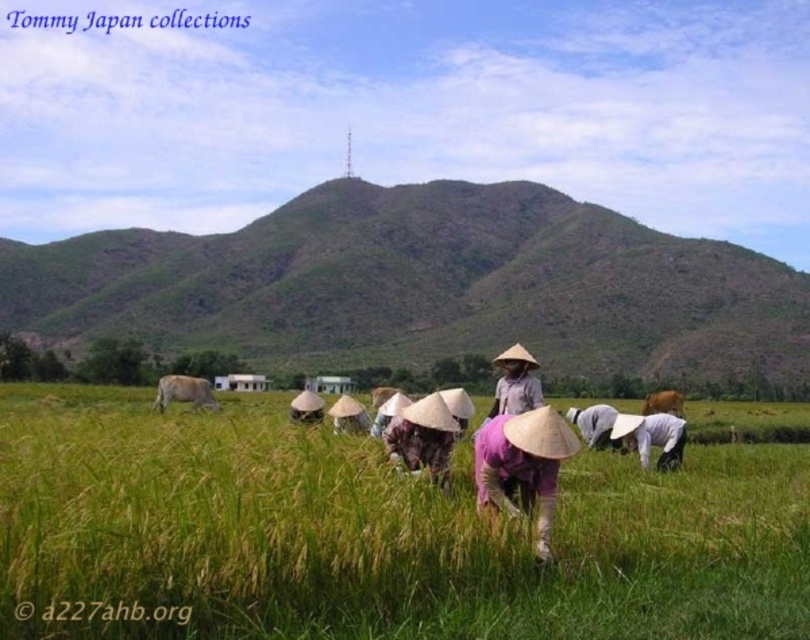
You are standing at the point marked as point (x=203, y=394) and want to walk towards the communication tower in the background. Is the point marked as point (x=536, y=422) located between you and the communication tower?

Yes, the point marked as point (x=536, y=422) is between you and the communication tower because it is closer to the viewer than point (x=203, y=394).

You are a photographer trying to capture a photo of the brown furry cow at left and the purple fabric hat at center. Which object should you focus on first if you want to include both in your shot without moving the camera?

The brown furry cow at left should be focused on first because it is positioned to the left of the purple fabric hat at center, so adjusting focus to the left ensures both are in frame.